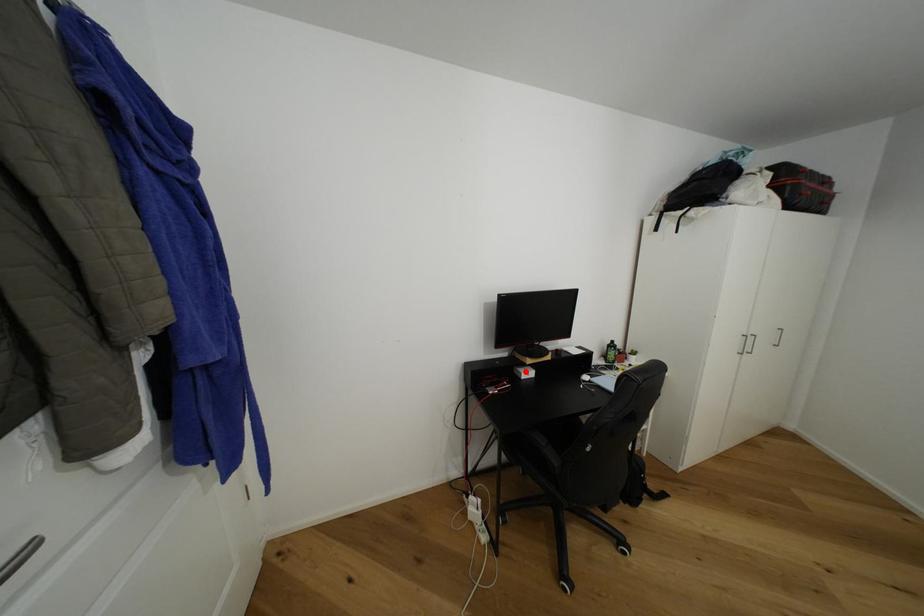
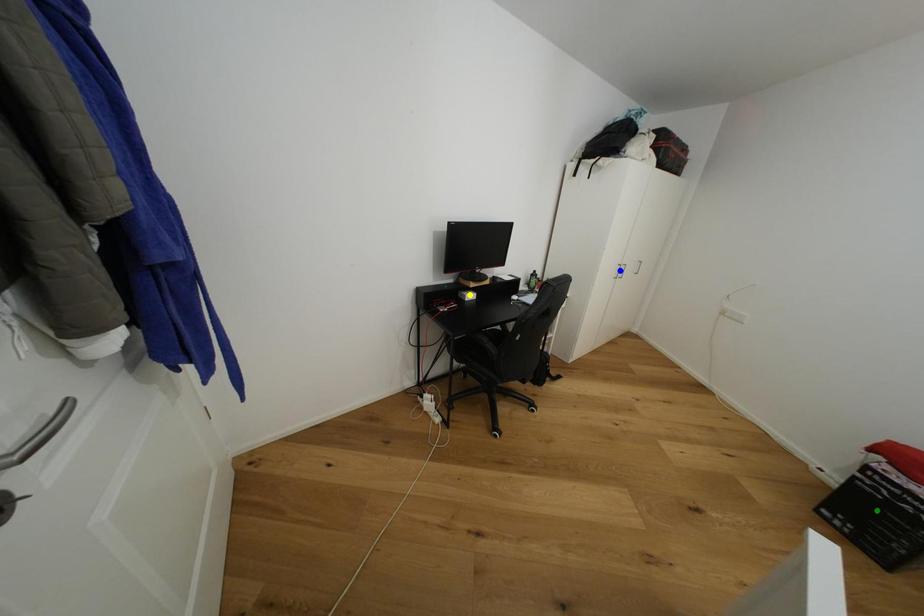
Question: I am providing you with two images of the same scene from different viewpoints. A red point is marked on the first image. You are given multiple points on the second image. Which point in image 2 represents the same 3d spot as the red point in image 1?

Choices:
 (A) blue point
 (B) yellow point
 (C) green point

Answer: (B)